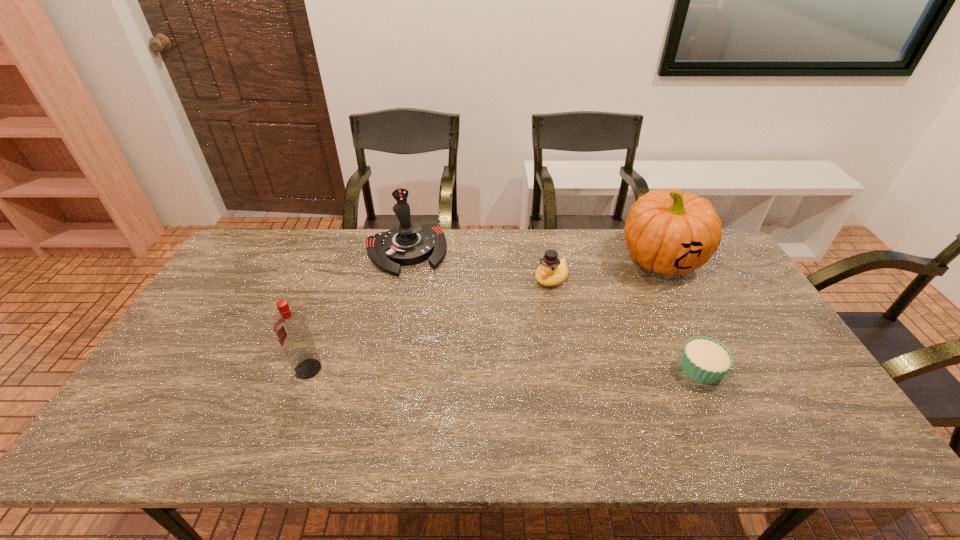
Where is `duck located in the far edge section of the desktop`? duck located in the far edge section of the desktop is located at coordinates pyautogui.click(x=552, y=271).

Find the location of a particular element. pumpkin positioned at the far edge is located at coordinates (667, 232).

Locate an element on the screen. The width and height of the screenshot is (960, 540). object located in the near edge section of the desktop is located at coordinates (704, 360).

In order to click on object that is at the right edge in this screenshot , I will do `click(667, 232)`.

This screenshot has width=960, height=540. Identify the location of object at the far right corner. click(667, 232).

Locate an element on the screen. The height and width of the screenshot is (540, 960). vacant region at the far edge of the desktop is located at coordinates (317, 269).

You are a GUI agent. You are given a task and a screenshot of the screen. Output one action in this format:
    pyautogui.click(x=<x>, y=<y>)
    Task: Click on the vacant space at the near edge of the desktop
    The height and width of the screenshot is (540, 960).
    Given the screenshot: What is the action you would take?
    pyautogui.click(x=666, y=388)

Where is `free space at the left edge`? free space at the left edge is located at coordinates (171, 362).

The image size is (960, 540). I want to click on vacant space at the right edge, so click(734, 331).

Find the location of `vacant space at the far left corner of the desktop`. vacant space at the far left corner of the desktop is located at coordinates (268, 267).